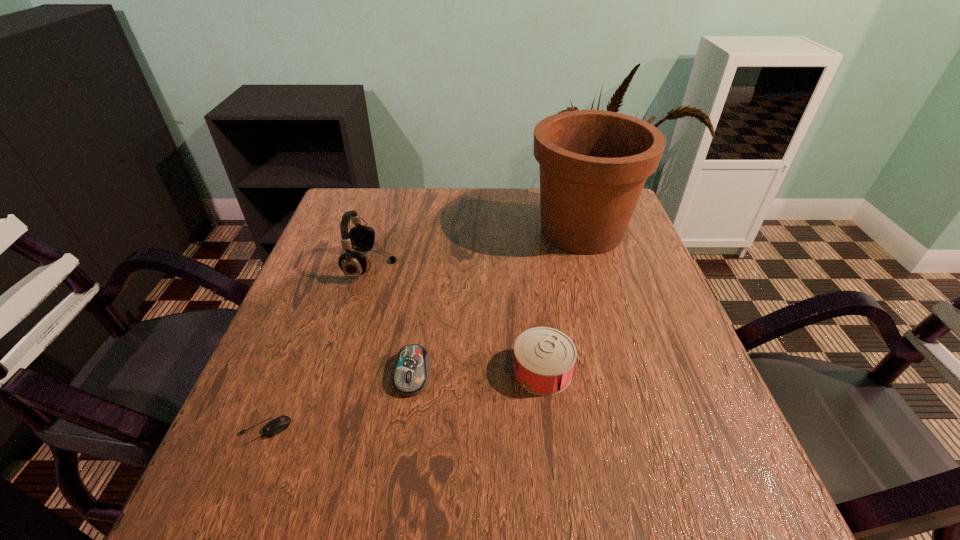
Locate an element on the screen. The height and width of the screenshot is (540, 960). flowerpot is located at coordinates pos(593,164).

Where is `the fourth shortest object`? The image size is (960, 540). the fourth shortest object is located at coordinates (361, 238).

You are a GUI agent. You are given a task and a screenshot of the screen. Output one action in this format:
    pyautogui.click(x=<x>, y=<y>)
    Task: Click on the can
    The height and width of the screenshot is (540, 960).
    Given the screenshot: What is the action you would take?
    pyautogui.click(x=544, y=358)

Locate an element on the screen. the taller mouse is located at coordinates (410, 376).

The width and height of the screenshot is (960, 540). I want to click on the second shortest object, so click(x=410, y=376).

Identify the location of the shorter mouse. (279, 424).

Where is `the left mouse`? The width and height of the screenshot is (960, 540). the left mouse is located at coordinates (279, 424).

This screenshot has height=540, width=960. Identify the location of vacant space located 0.270m on the left of the tallest object. (428, 230).

Identify the location of free region located with the microphone on the side of the headset. The height and width of the screenshot is (540, 960). (549, 266).

This screenshot has width=960, height=540. I want to click on free region located 0.160m on the front of the third shortest object, so click(x=557, y=484).